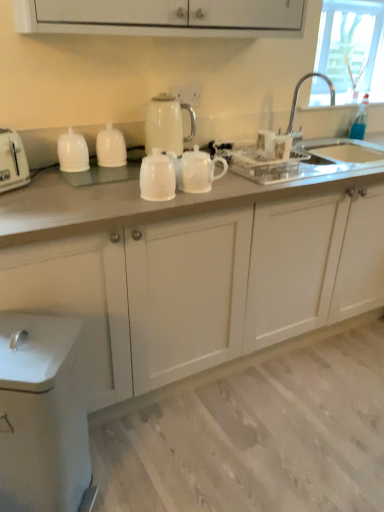
Question: Do you think blue glass bottle at upper right is within white glossy teapot at center, or outside of it?

Choices:
 (A) outside
 (B) inside

Answer: (A)

Question: In terms of width, does blue glass bottle at upper right look wider or thinner when compared to white glossy teapot at center?

Choices:
 (A) thin
 (B) wide

Answer: (A)

Question: Based on their relative distances, which object is nearer to the transparent glass window at upper right?

Choices:
 (A) white glossy cups at center, the first tableware from the left
 (B) white plastic toaster at left
 (C) silver metallic faucet at upper right
 (D) white glossy electric kettle at upper center
 (E) white matte teapot at center, the 3th tableware positioned from the left

Answer: (C)

Question: Estimate the real-world distances between objects in this image. Which object is closer to the white glossy electric kettle at upper center?

Choices:
 (A) white glossy cups at center, which is the 3th tableware in right-to-left order
 (B) white glossy teapot at center, the 2th tableware positioned from the left
 (C) silver metallic faucet at upper right
 (D) white matte teapot at center, the 3th tableware positioned from the left
 (E) blue glass bottle at upper right

Answer: (B)